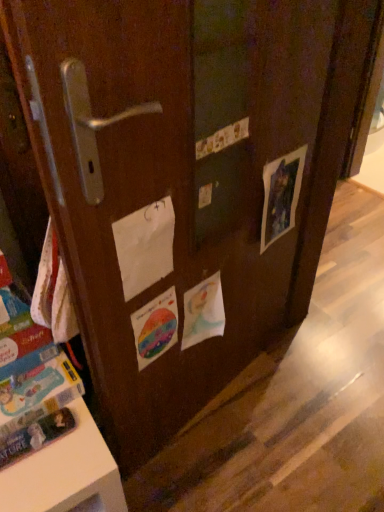
Question: From the image's perspective, does white paper at center appear lower than matte paper picture at right, positioned as the first flyer in right-to-left order?

Choices:
 (A) no
 (B) yes

Answer: (B)

Question: Is white paper at center outside matte paper picture at right, positioned as the first flyer in right-to-left order?

Choices:
 (A) no
 (B) yes

Answer: (B)

Question: Is white paper at center at the right side of matte paper picture at right, the 3th flyer when ordered from left to right?

Choices:
 (A) no
 (B) yes

Answer: (A)

Question: Is matte paper picture at right, the 3th flyer when ordered from left to right, a part of white paper at center?

Choices:
 (A) yes
 (B) no

Answer: (B)

Question: Is white paper at center further to camera compared to matte paper picture at right, the 3th flyer when ordered from left to right?

Choices:
 (A) no
 (B) yes

Answer: (A)

Question: Does white paper at center have a lesser width compared to matte paper picture at right, the 3th flyer when ordered from left to right?

Choices:
 (A) no
 (B) yes

Answer: (B)

Question: Is blue cardboard book at lower left positioned beyond the bounds of rainbow paper flyer at center, placed as the 3th flyer when sorted from right to left?

Choices:
 (A) no
 (B) yes

Answer: (B)

Question: Considering the relative sizes of blue cardboard book at lower left and rainbow paper flyer at center, which is counted as the 1th flyer, starting from the left, in the image provided, is blue cardboard book at lower left shorter than rainbow paper flyer at center, which is counted as the 1th flyer, starting from the left,?

Choices:
 (A) yes
 (B) no

Answer: (A)

Question: Is blue cardboard book at lower left wider than rainbow paper flyer at center, placed as the 3th flyer when sorted from right to left?

Choices:
 (A) no
 (B) yes

Answer: (B)

Question: From a real-world perspective, is blue cardboard book at lower left physically below rainbow paper flyer at center, placed as the 3th flyer when sorted from right to left?

Choices:
 (A) no
 (B) yes

Answer: (B)

Question: Does blue cardboard book at lower left have a larger size compared to rainbow paper flyer at center, which is counted as the 1th flyer, starting from the left?

Choices:
 (A) yes
 (B) no

Answer: (A)

Question: Is blue cardboard book at lower left surrounding rainbow paper flyer at center, which is counted as the 1th flyer, starting from the left?

Choices:
 (A) no
 (B) yes

Answer: (A)

Question: Is blue cardboard book at lower left bigger than matte paper picture at right, positioned as the first flyer in right-to-left order?

Choices:
 (A) no
 (B) yes

Answer: (B)